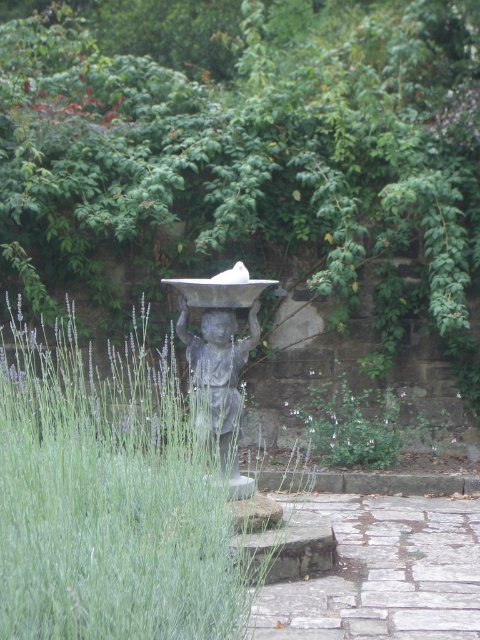
Question: Can you confirm if bronze statue at center is bigger than green leafy plant at center?

Choices:
 (A) yes
 (B) no

Answer: (B)

Question: Estimate the real-world distances between objects in this image. Which object is farther from the paved stone path at center?

Choices:
 (A) green leafy plant at center
 (B) green grass at center

Answer: (B)

Question: Which object is farther from the camera taking this photo?

Choices:
 (A) bronze statue at center
 (B) paved stone path at center
 (C) green grass at center

Answer: (A)

Question: From the image, what is the correct spatial relationship of bronze statue at center in relation to green leafy plant at center?

Choices:
 (A) left
 (B) right

Answer: (A)

Question: Among these objects, which one is nearest to the camera?

Choices:
 (A) green grass at center
 (B) green leafy plant at center
 (C) paved stone path at center
 (D) bronze statue at center

Answer: (A)

Question: Is green grass at center closer to camera compared to bronze statue at center?

Choices:
 (A) yes
 (B) no

Answer: (A)